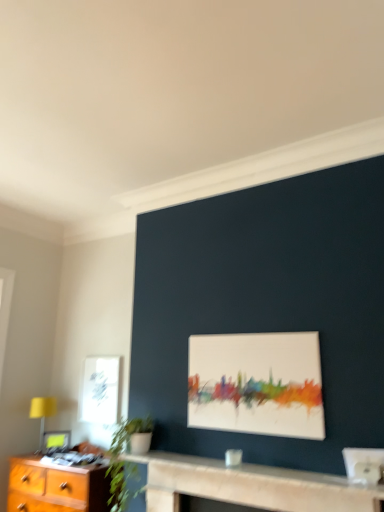
Find the location of a particular element. blank space situated above white matte painting at center, positioned as the 1th picture frame in front-to-back order (from a real-world perspective) is located at coordinates (247, 332).